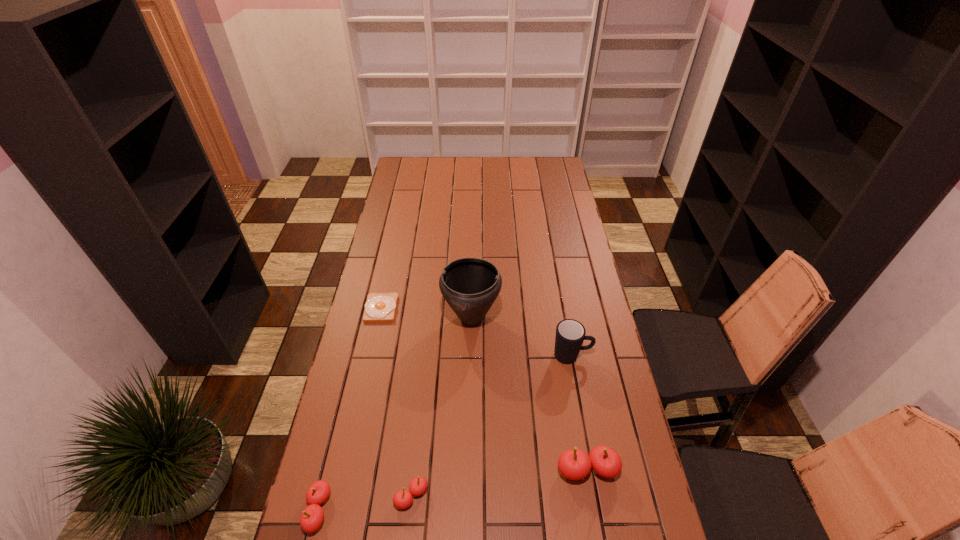
Where is `vacant position for inserting another cherry evenly`? This screenshot has width=960, height=540. vacant position for inserting another cherry evenly is located at coordinates (501, 482).